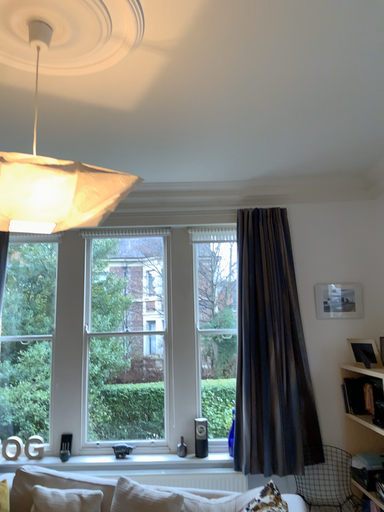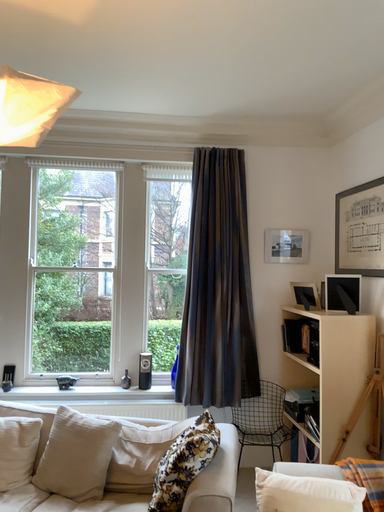
Question: Which way did the camera rotate in the video?

Choices:
 (A) rotated upward
 (B) rotated downward

Answer: (B)